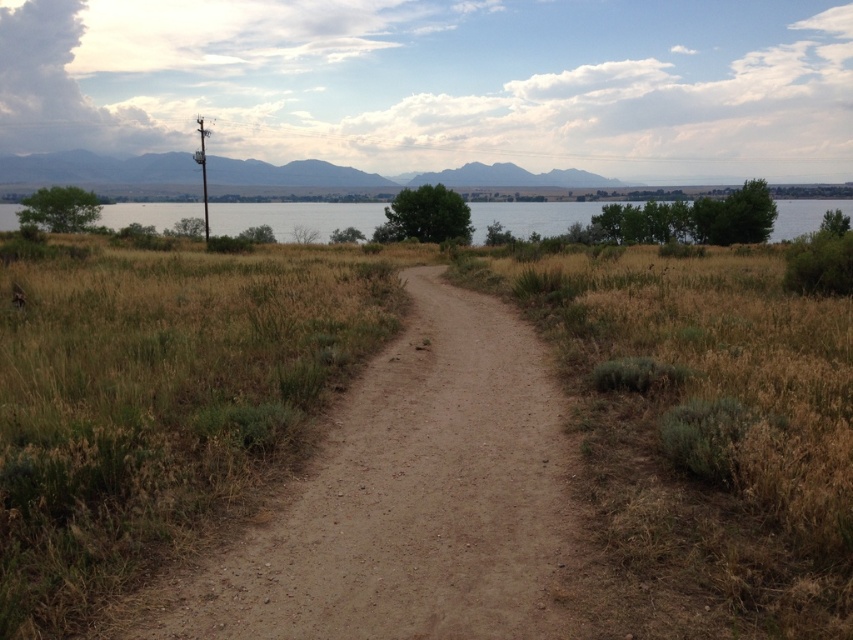
You are a hiker with a 70 meter long rope. You want to cross the clear water at upper center using the dull brown dirt track at center as an anchor point. Will your rope be long enough to reach the other side?

The distance between the dull brown dirt track at center and the clear water at upper center is 75.13 meters. Since your rope is only 70 meters long, it will not be long enough to reach the other side.

You are a hiker planning to walk along the dull brown dirt track at center and the clear water at upper center. Which of these two features takes up more area in the image?

The clear water at upper center occupies more space than the dull brown dirt track at center.